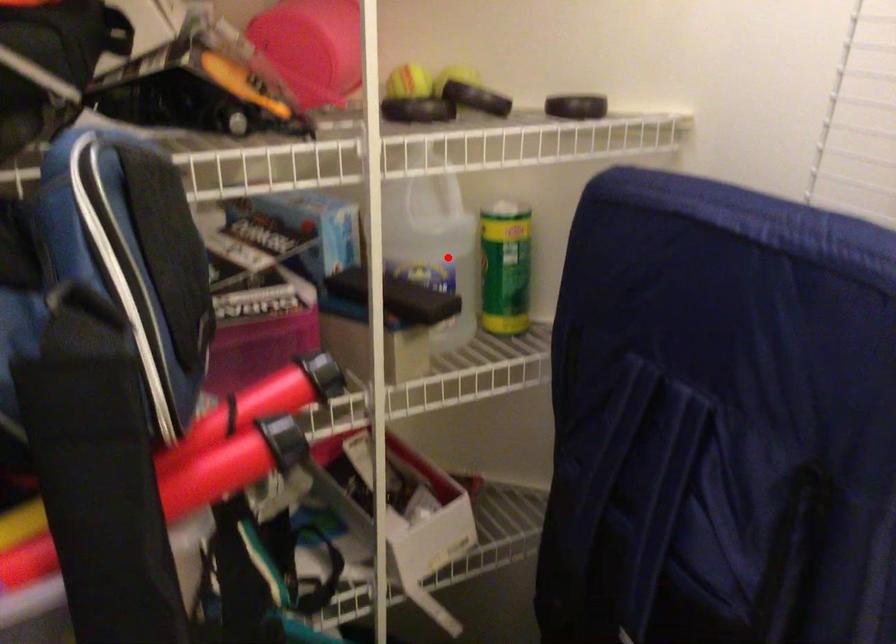
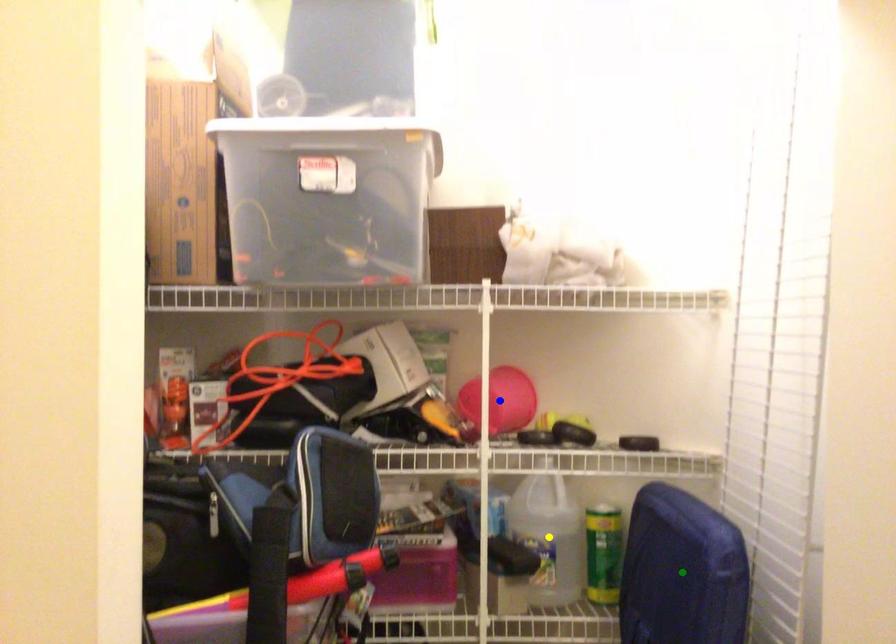
Question: I am providing you with two images of the same scene from different viewpoints. A red point is marked on the first image. You are given multiple points on the second image. Can you choose the point in image 2 that corresponds to the point in image 1?

Choices:
 (A) green point
 (B) blue point
 (C) yellow point

Answer: (C)